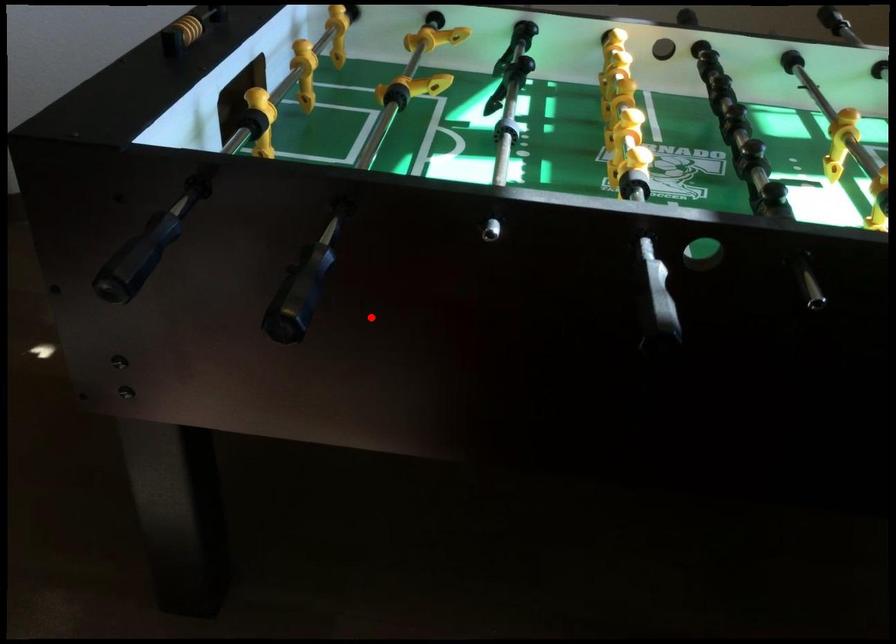
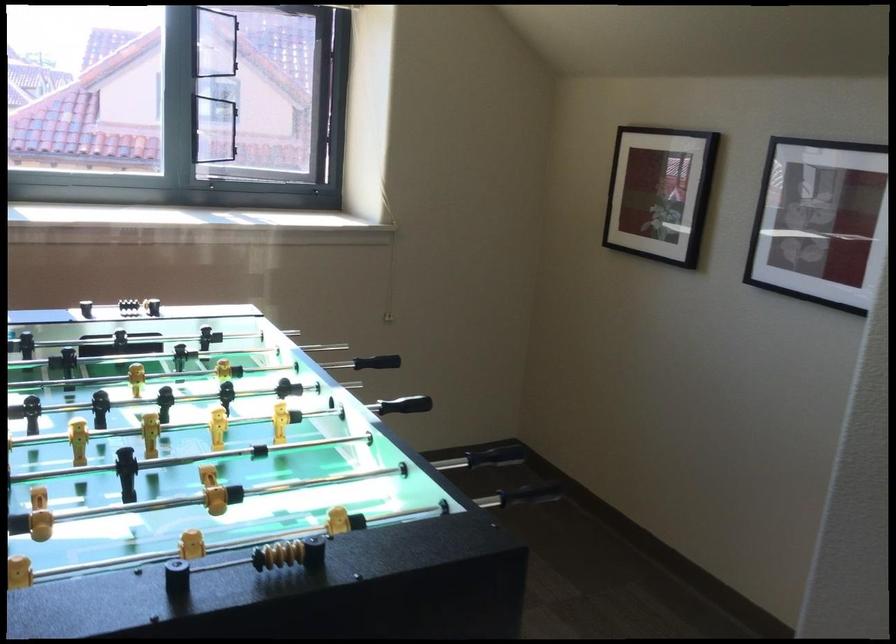
Question: I am providing you with two images of the same scene from different viewpoints. In image1, a red point is highlighted. Considering the same 3D point in image2, which of the following is correct?

Choices:
 (A) It is closer
 (B) It is farther

Answer: (B)